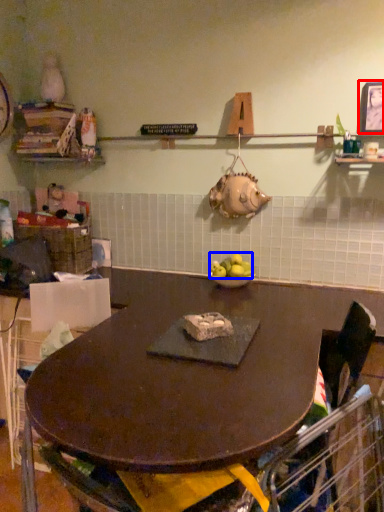
Question: Which object appears closest to the camera in this image, picture frame (highlighted by a red box) or apple (highlighted by a blue box)?

Choices:
 (A) picture frame
 (B) apple

Answer: (A)